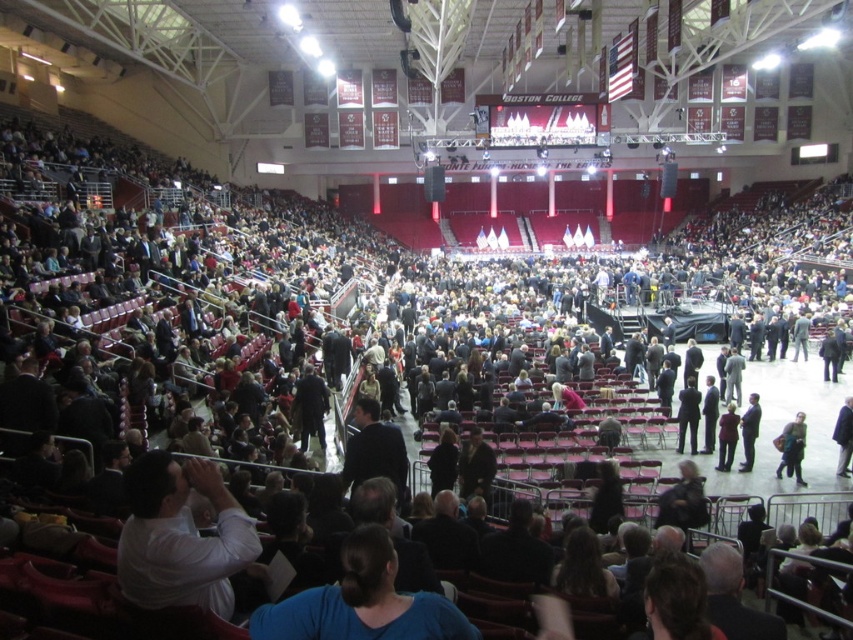
Question: Does white shirt at lower left appear under dark gray fabric jacket at lower right?

Choices:
 (A) yes
 (B) no

Answer: (B)

Question: Is white shirt at lower left below dark gray fabric jacket at lower right?

Choices:
 (A) no
 (B) yes

Answer: (A)

Question: Does white shirt at lower left have a larger size compared to dark gray fabric jacket at lower right?

Choices:
 (A) no
 (B) yes

Answer: (B)